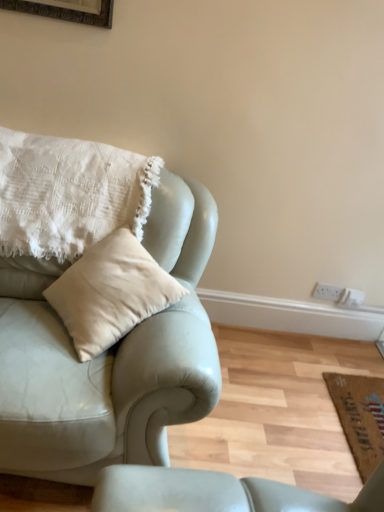
At what (x,y) coordinates should I click in order to perform the action: click on vacant area on the back side of brown woven mat at lower right. Please return your answer as a coordinate pair (x, y). This screenshot has width=384, height=512. Looking at the image, I should click on (335, 355).